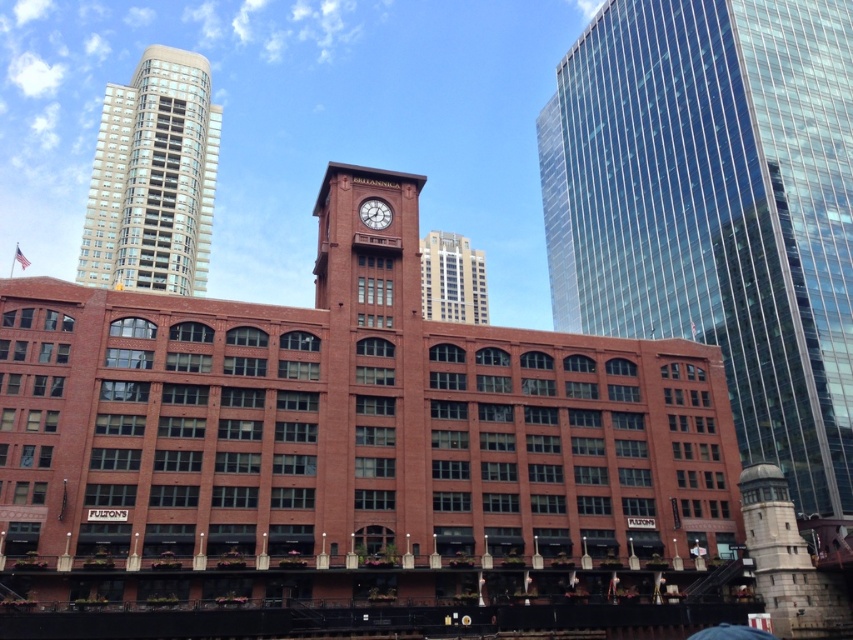
Which is in front, point (722, 22) or point (451, 276)?

Point (722, 22) is in front.

Is glassy reflective skyscraper at upper right wider than glassy reflective skyscraper at upper center?

Yes.

Who is more distant from viewer, (820, 301) or (431, 248)?

Positioned behind is point (431, 248).

This screenshot has height=640, width=853. Find the location of `glassy reflective skyscraper at upper right`. glassy reflective skyscraper at upper right is located at coordinates (717, 209).

Can you confirm if glassy reflective skyscraper at upper right is smaller than beige glassy building at upper left?

Actually, glassy reflective skyscraper at upper right might be larger than beige glassy building at upper left.

Between glassy reflective skyscraper at upper right and beige glassy building at upper left, which one has more height?

Standing taller between the two is glassy reflective skyscraper at upper right.

Between point (599, 24) and point (131, 216), which one is positioned in front?

Point (599, 24) is in front.

Where is `glassy reflective skyscraper at upper right`? The height and width of the screenshot is (640, 853). glassy reflective skyscraper at upper right is located at coordinates (717, 209).

In the scene shown: Between glassy reflective skyscraper at upper right and matte red clock at center, which one is positioned higher?

glassy reflective skyscraper at upper right is higher up.

Is point (642, 83) positioned after point (373, 216)?

Yes, point (642, 83) is behind point (373, 216).

Does point (663, 42) come in front of point (386, 209)?

No.

Find the location of a particular element. glassy reflective skyscraper at upper right is located at coordinates (717, 209).